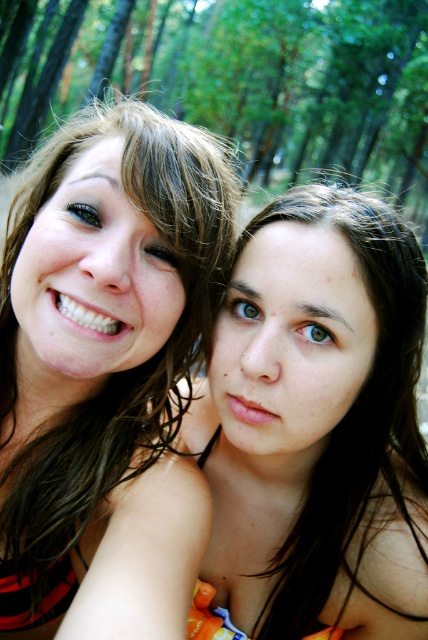
Question: Which point appears closest to the camera in this image?

Choices:
 (A) click(x=95, y=20)
 (B) click(x=33, y=211)

Answer: (B)

Question: Does matte black bikini top at left have a larger size compared to green leafy trees at upper center?

Choices:
 (A) yes
 (B) no

Answer: (B)

Question: Is matte black bikini top at left to the right of green leafy trees at upper center from the viewer's perspective?

Choices:
 (A) no
 (B) yes

Answer: (A)

Question: Which point appears closest to the camera in this image?

Choices:
 (A) (124, 294)
 (B) (243, 13)

Answer: (A)

Question: Does matte black bikini top at left appear on the left side of green leafy trees at upper center?

Choices:
 (A) no
 (B) yes

Answer: (B)